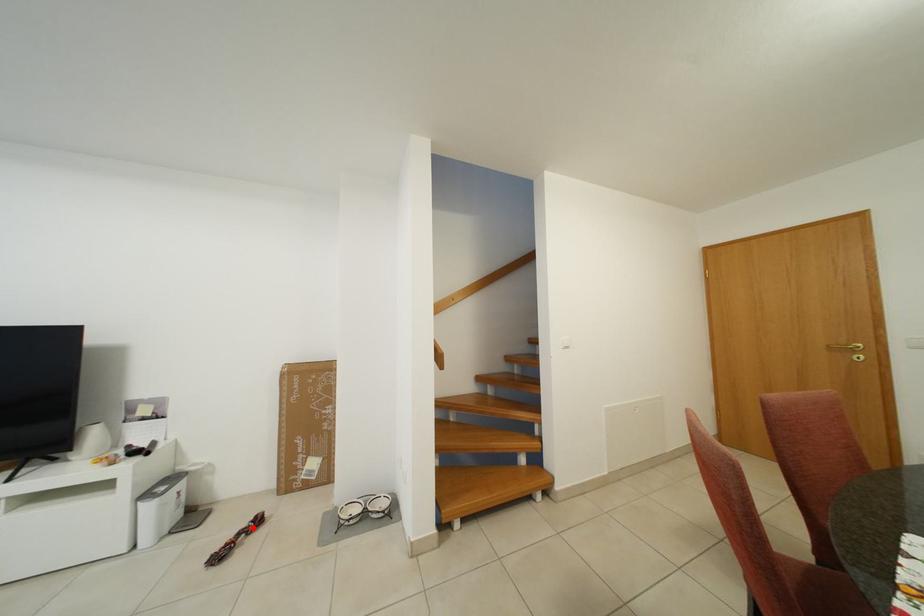
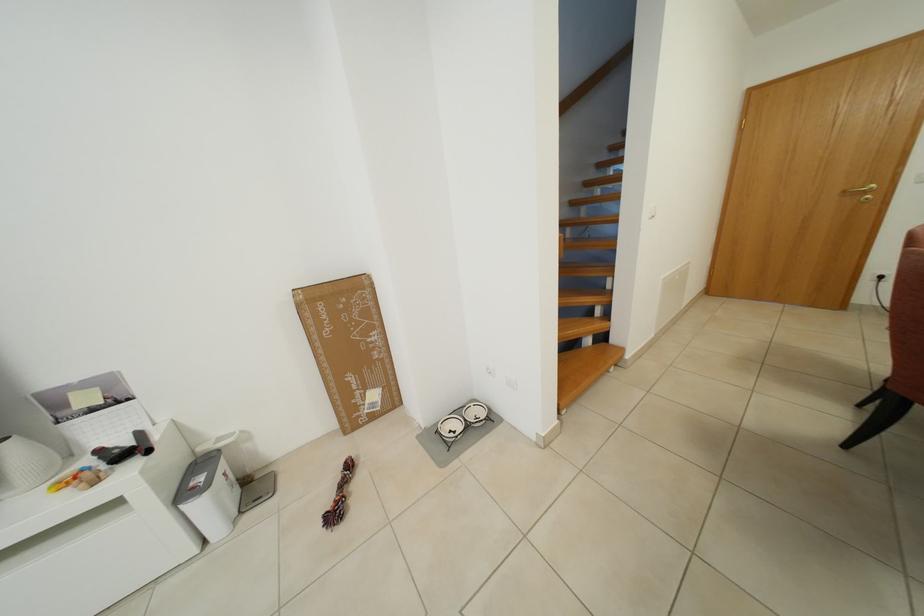
Question: A red point is marked in image1. In image2, is the corresponding 3D point closer to the camera or farther? Reply with the corresponding letter.

Choices:
 (A) The corresponding 3D point is closer.
 (B) The corresponding 3D point is farther.

Answer: (A)